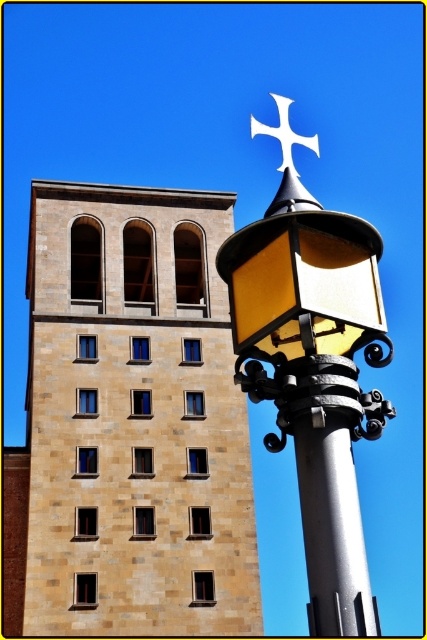
You are standing at the center of the image and want to locate the brown stone building at upper left. Based on the coordinates provided, in which direction should you look to find it?

The brown stone building at upper left is located at coordinates point (x=134, y=419), so you should look to the upper left direction to find it.